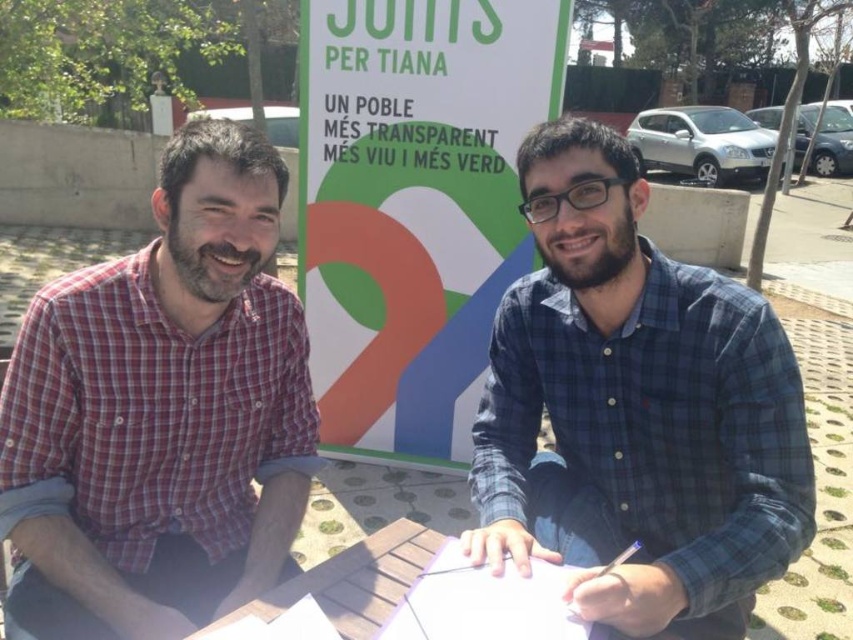
You are a photographer trying to capture both the blue plaid shirt at center and the green paper sign at center in a single frame. Based on their sizes, which object should you focus on to ensure both fit in the frame?

The blue plaid shirt at center has a lesser width compared to the green paper sign at center, so you should focus on the green paper sign at center to ensure both fit in the frame since it is wider and will require more space.

You are a photographer trying to capture a photo of the scene. You need to ensure that both the plaid cotton shirt at left and the green paper sign at center are visible in the frame. Based on their positions, which object should you prioritize keeping centered to ensure both are in the shot?

The green paper sign at center is positioned centrally, so prioritizing it as the center of the frame would naturally include the plaid cotton shirt at left, which is to the left of it.

You are a photographer trying to capture a photo of the plaid cotton shirt at left and the wooden picnic table at center. Which object should you focus on first if you want to ensure both are in sharp focus?

The plaid cotton shirt at left is much taller than the wooden picnic table at center, so focusing on the shirt first would help ensure both are in sharp focus since it is closer to the camera.